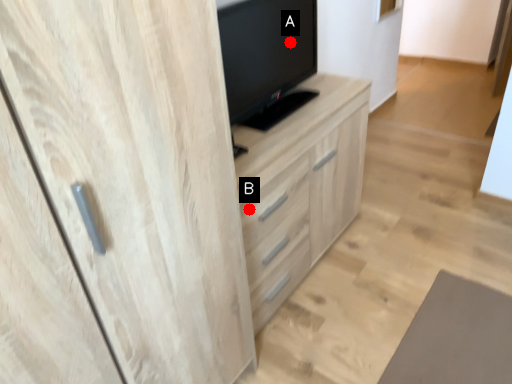
Question: Two points are circled on the image, labeled by A and B beside each circle. Which of the following is the closest to the observer?

Choices:
 (A) A is closer
 (B) B is closer

Answer: (B)